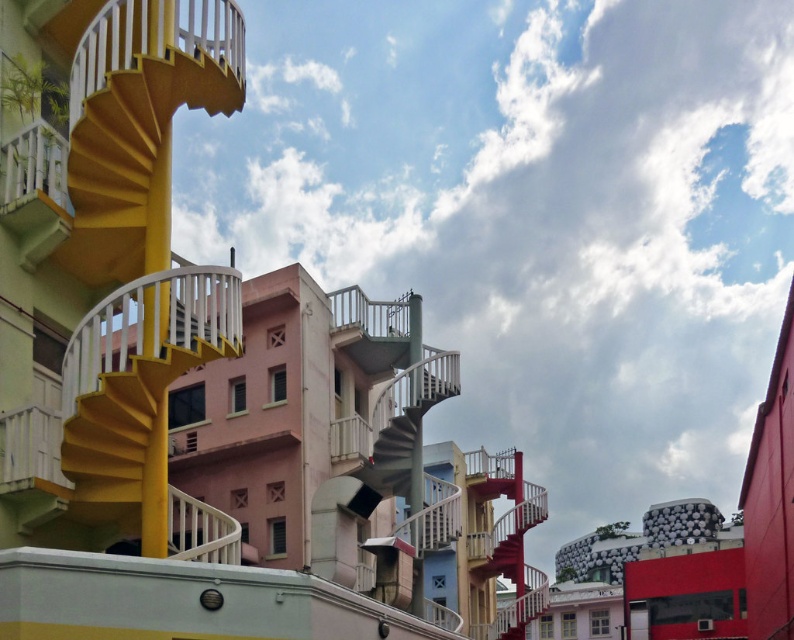
Question: Does yellow matte spiral staircase at left have a lesser width compared to metallic gray staircase at center?

Choices:
 (A) no
 (B) yes

Answer: (A)

Question: Which of the following is the farthest from the observer?

Choices:
 (A) (195, 556)
 (B) (207, 92)

Answer: (B)

Question: Which point is closer to the camera?

Choices:
 (A) (133, 433)
 (B) (482, 552)

Answer: (A)

Question: Can you confirm if yellow matte spiral staircase at left is positioned above metallic yellow spiral staircase at left?

Choices:
 (A) no
 (B) yes

Answer: (A)

Question: Which of the following is the closest to the observer?

Choices:
 (A) metallic yellow spiral staircase at left
 (B) metallic gray staircase at center
 (C) yellow matte spiral staircase at left

Answer: (C)

Question: Does yellow matte spiral staircase at left appear under metallic yellow spiral staircase at left?

Choices:
 (A) yes
 (B) no

Answer: (A)